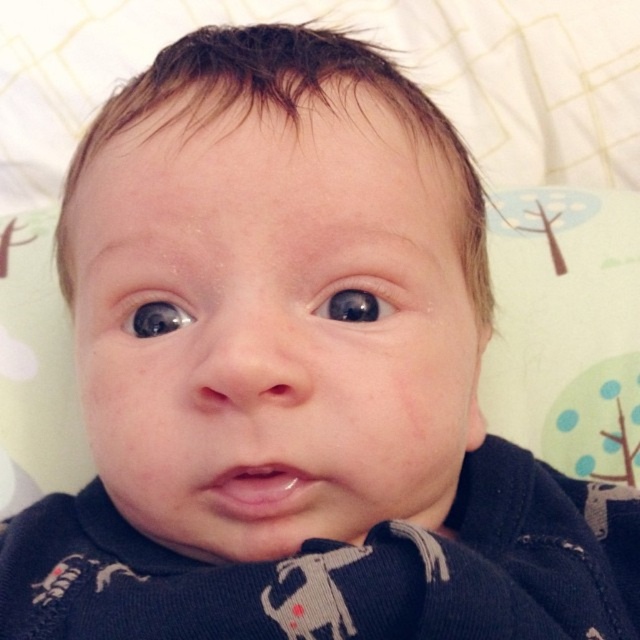
What do you see at coordinates (356, 300) in the screenshot? Image resolution: width=640 pixels, height=640 pixels. I see `black glossy eye at center` at bounding box center [356, 300].

Is black glossy eye at center smaller than black glossy eye at upper left?

Yes, black glossy eye at center is smaller than black glossy eye at upper left.

Identify the location of black glossy eye at center. (x=356, y=300).